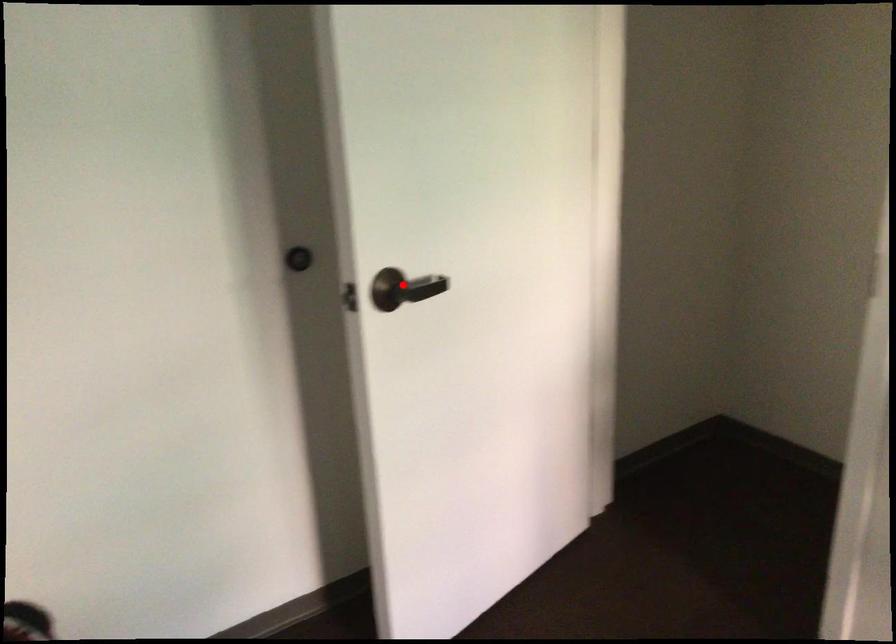
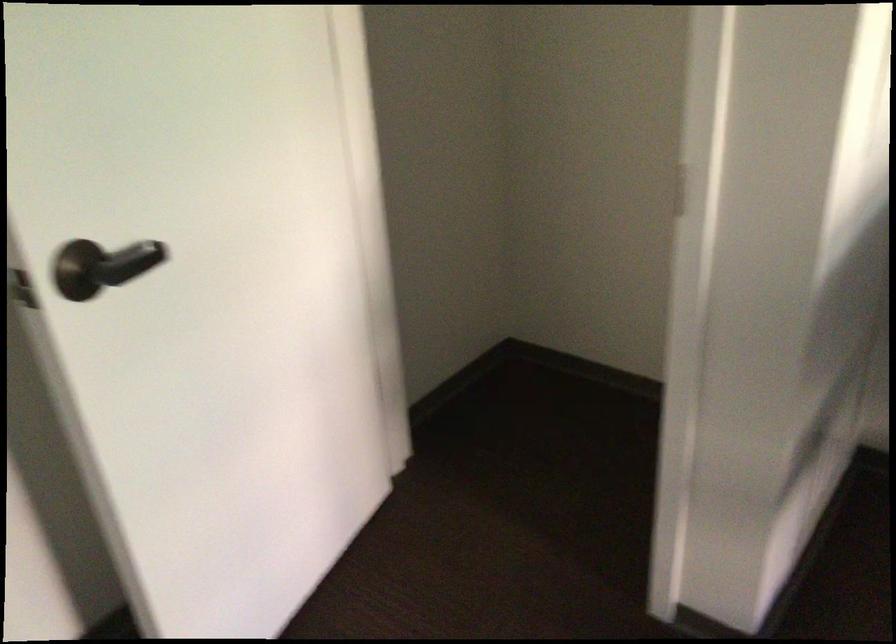
Question: I am providing you with two images of the same scene from different viewpoints. Image1 has a red point marked. In image2, the corresponding 3D location appears at what relative position? Reply with the corresponding letter.

Choices:
 (A) Closer
 (B) Farther

Answer: (A)